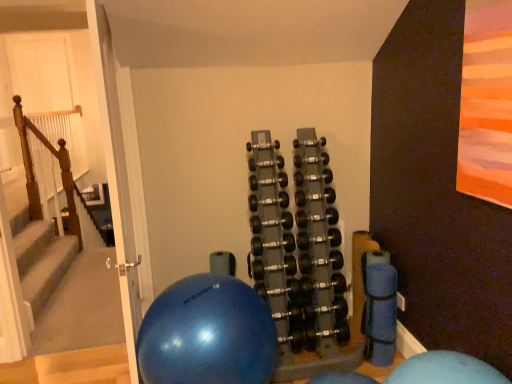
Question: Is blue rubber ball at center not within black rubber dumbbells at center?

Choices:
 (A) yes
 (B) no

Answer: (A)

Question: From a real-world perspective, is blue rubber ball at center physically below black rubber dumbbells at center?

Choices:
 (A) no
 (B) yes

Answer: (B)

Question: Is blue rubber ball at center at the left side of black rubber dumbbells at center?

Choices:
 (A) yes
 (B) no

Answer: (A)

Question: Is blue rubber ball at center positioned before black rubber dumbbells at center?

Choices:
 (A) no
 (B) yes

Answer: (B)

Question: Can you confirm if blue rubber ball at center is positioned to the right of black rubber dumbbells at center?

Choices:
 (A) no
 (B) yes

Answer: (A)

Question: From the image's perspective, does blue rubber ball at center appear higher than black rubber dumbbells at center?

Choices:
 (A) yes
 (B) no

Answer: (B)

Question: From a real-world perspective, is wooden at left over blue rubber ball at center?

Choices:
 (A) yes
 (B) no

Answer: (A)

Question: From a real-world perspective, is wooden at left under blue rubber ball at center?

Choices:
 (A) yes
 (B) no

Answer: (B)

Question: Are wooden at left and blue rubber ball at center making contact?

Choices:
 (A) no
 (B) yes

Answer: (A)

Question: Can you confirm if wooden at left is positioned to the right of blue rubber ball at center?

Choices:
 (A) yes
 (B) no

Answer: (B)

Question: Is wooden at left not near blue rubber ball at center?

Choices:
 (A) no
 (B) yes

Answer: (B)

Question: Is wooden at left smaller than blue rubber ball at center?

Choices:
 (A) yes
 (B) no

Answer: (A)

Question: Is wooden at left wider than black rubber dumbbells at center?

Choices:
 (A) yes
 (B) no

Answer: (B)